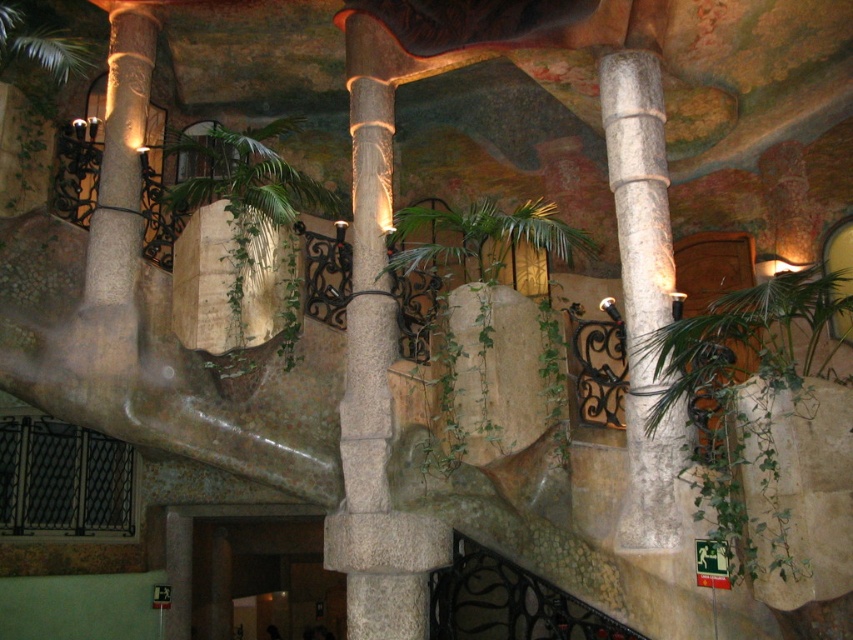
You are standing in the center of the room and want to water both the green leafy plant at right and the green leafy plant at center. Which plant should you water first if you want to minimize your walking distance?

You should water the green leafy plant at center first because it is closer to your current position at the center of the room than the green leafy plant at right, which is further away to the right side.

Looking at this image, you are a maintenance worker needing to water the green leafy plant at center and the white marble column at right. Your watering can has a 3.5 feet long extendable hose. Can you reach both objects without moving the watering can?

The distance between the green leafy plant at center and the white marble column at right is 3.37 feet. Since the extendable hose is 3.5 feet long, it is long enough to reach both objects without moving the watering can.

You are standing in the center of this organic interior space and want to move towards the white marble column at right. Which direction should you walk to avoid the green leafy plant at center?

Since the green leafy plant at center is to the left of the white marble column at right, you should walk to the right side of the column to avoid it.